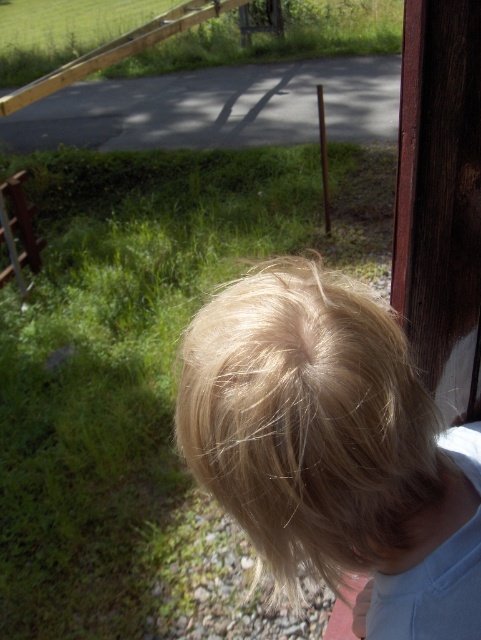
Question: In this image, where is blonde hair at upper right located relative to brushed metal fence at left?

Choices:
 (A) right
 (B) left

Answer: (A)

Question: Is blonde hair at upper right above brushed metal fence at left?

Choices:
 (A) yes
 (B) no

Answer: (B)

Question: Among these points, which one is farthest from the camera?

Choices:
 (A) (404, 456)
 (B) (21, 257)

Answer: (B)

Question: Which point is closer to the camera?

Choices:
 (A) brushed metal fence at left
 (B) blonde hair at upper right

Answer: (B)

Question: Can you confirm if blonde hair at upper right is thinner than brushed metal fence at left?

Choices:
 (A) yes
 (B) no

Answer: (A)